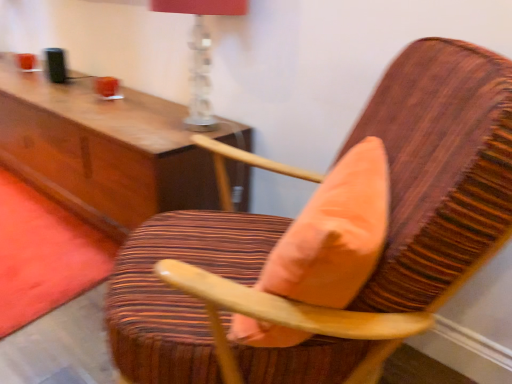
Question: Considering their positions, is coral velvet throw pillow at center located in front of or behind wooden chair with striped upholstery at center?

Choices:
 (A) front
 (B) behind

Answer: (B)

Question: Does point (279, 246) appear closer or farther from the camera than point (199, 369)?

Choices:
 (A) closer
 (B) farther

Answer: (A)

Question: Estimate the real-world distances between objects in this image. Which object is closer to the wooden chair with striped upholstery at center?

Choices:
 (A) coral velvet throw pillow at center
 (B) translucent glass table lamp at upper center

Answer: (A)

Question: Which of these objects is positioned farthest from the wooden chair with striped upholstery at center?

Choices:
 (A) coral velvet throw pillow at center
 (B) translucent glass table lamp at upper center

Answer: (B)